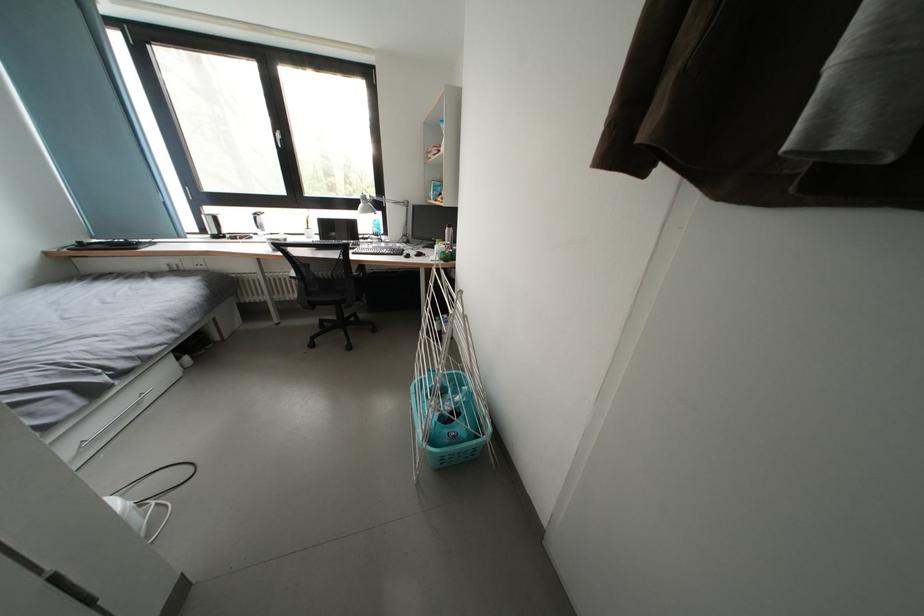
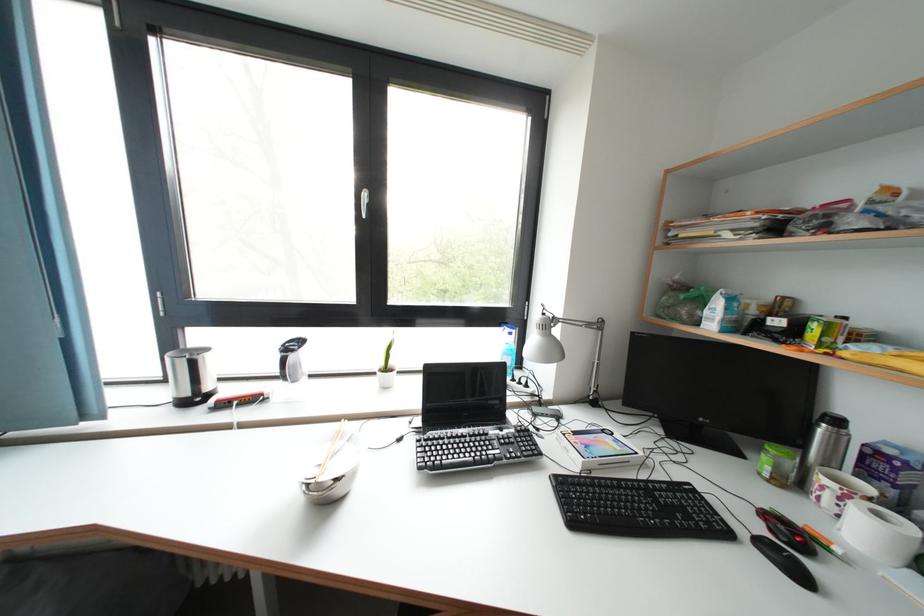
Which direction would the cameraman need to move to produce the second image?

The cameraman moved toward left, forward.